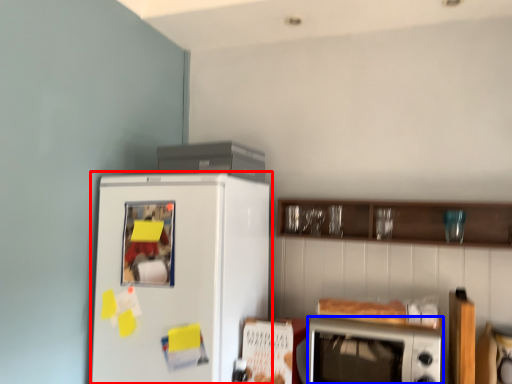
Question: Which object is further to the camera taking this photo, refrigerator (highlighted by a red box) or microwave oven (highlighted by a blue box)?

Choices:
 (A) refrigerator
 (B) microwave oven

Answer: (A)